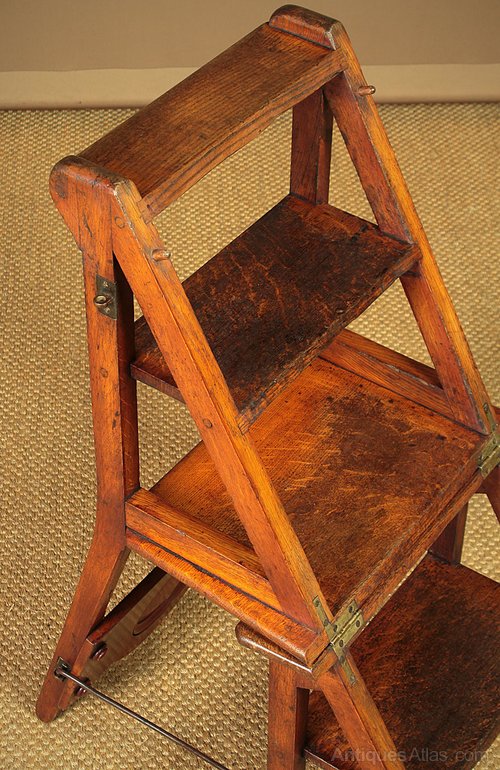
The height and width of the screenshot is (770, 500). I want to click on carpet, so click(225, 671).